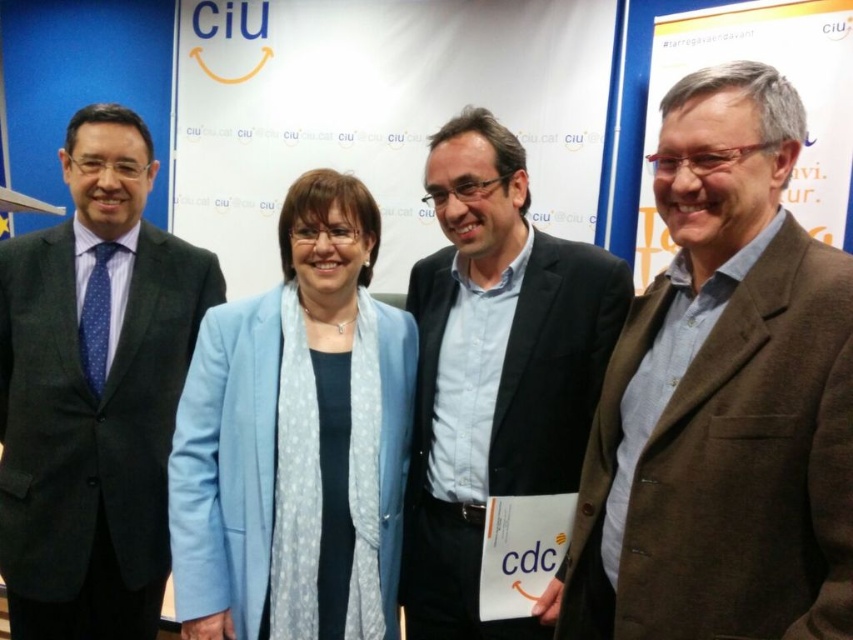
Question: Which point is farther from the camera taking this photo?

Choices:
 (A) (154, 408)
 (B) (314, 205)

Answer: (A)

Question: Is brown woolen blazer at right below blue shirt at center?

Choices:
 (A) yes
 (B) no

Answer: (A)

Question: Is brown woolen blazer at right further to camera compared to dark gray suit at left?

Choices:
 (A) no
 (B) yes

Answer: (A)

Question: Which point appears closest to the camera in this image?

Choices:
 (A) (128, 598)
 (B) (473, 212)

Answer: (B)

Question: Which is farther from the brown woolen blazer at right?

Choices:
 (A) blue shirt at center
 (B) matte blue jacket at center
 (C) dark gray suit at left

Answer: (C)

Question: Can you confirm if dark gray suit at left is positioned above blue shirt at center?

Choices:
 (A) no
 (B) yes

Answer: (A)